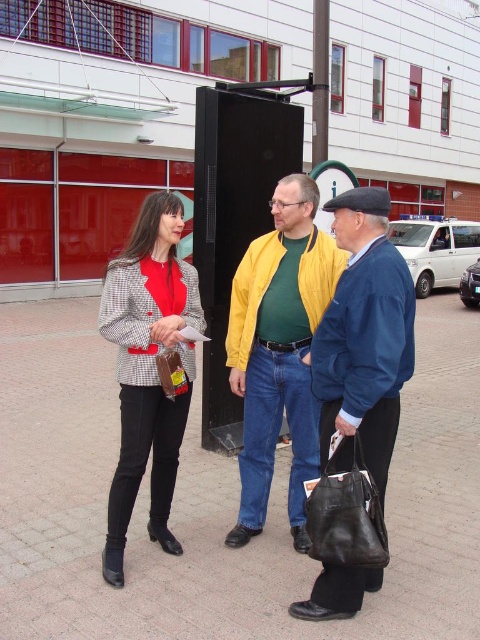
Can you confirm if matte yellow jacket at center is shorter than black plastic pole at center?

No.

The width and height of the screenshot is (480, 640). Describe the element at coordinates (278, 352) in the screenshot. I see `matte yellow jacket at center` at that location.

This screenshot has width=480, height=640. In order to click on matte yellow jacket at center in this screenshot , I will do `click(278, 352)`.

Does matte yellow jacket at center lie in front of black plastic bus stop at center?

Yes.

Can you confirm if matte yellow jacket at center is positioned to the right of black plastic bus stop at center?

Yes, matte yellow jacket at center is to the right of black plastic bus stop at center.

Find the location of `matte yellow jacket at center`. matte yellow jacket at center is located at coordinates (278, 352).

Can you confirm if checkered fabric jacket at left is smaller than black plastic pole at center?

No, checkered fabric jacket at left is not smaller than black plastic pole at center.

Consider the image. Who is more distant from viewer, (x=132, y=378) or (x=324, y=90)?

Point (x=324, y=90)

The width and height of the screenshot is (480, 640). I want to click on checkered fabric jacket at left, so click(148, 369).